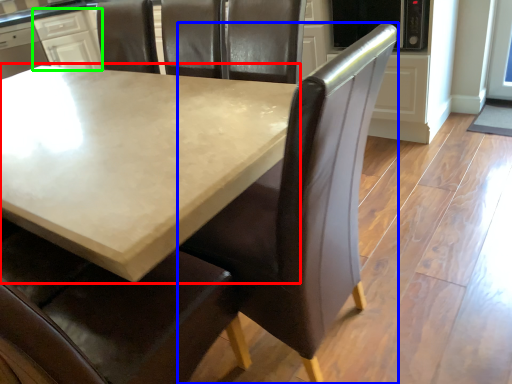
Question: Based on their relative distances, which object is farther from table (highlighted by a red box)? Choose from chair (highlighted by a blue box) and cabinetry (highlighted by a green box).

Choices:
 (A) chair
 (B) cabinetry

Answer: (B)